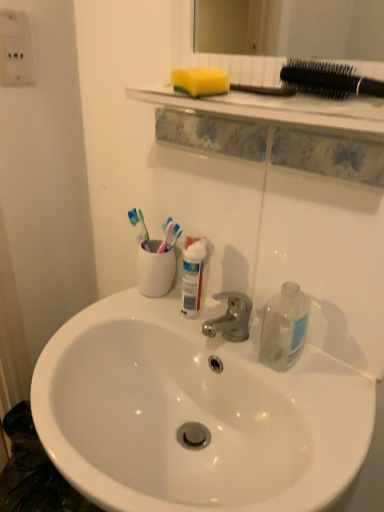
You are a GUI agent. You are given a task and a screenshot of the screen. Output one action in this format:
    pyautogui.click(x=<x>, y=<y>)
    Task: Click on the free space to the left of white glossy tube at center
    Image resolution: width=384 pixels, height=512 pixels.
    Given the screenshot: What is the action you would take?
    pyautogui.click(x=113, y=324)